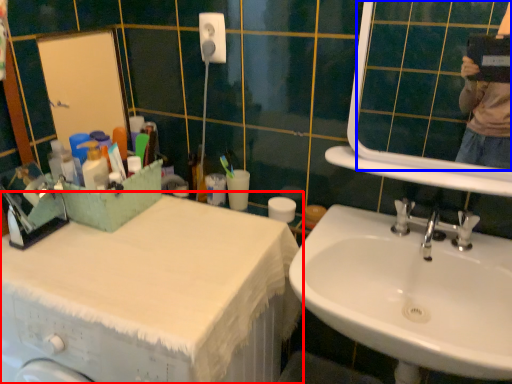
Question: Which point is closer to the camera, counter top (highlighted by a red box) or mirror (highlighted by a blue box)?

Choices:
 (A) counter top
 (B) mirror

Answer: (A)